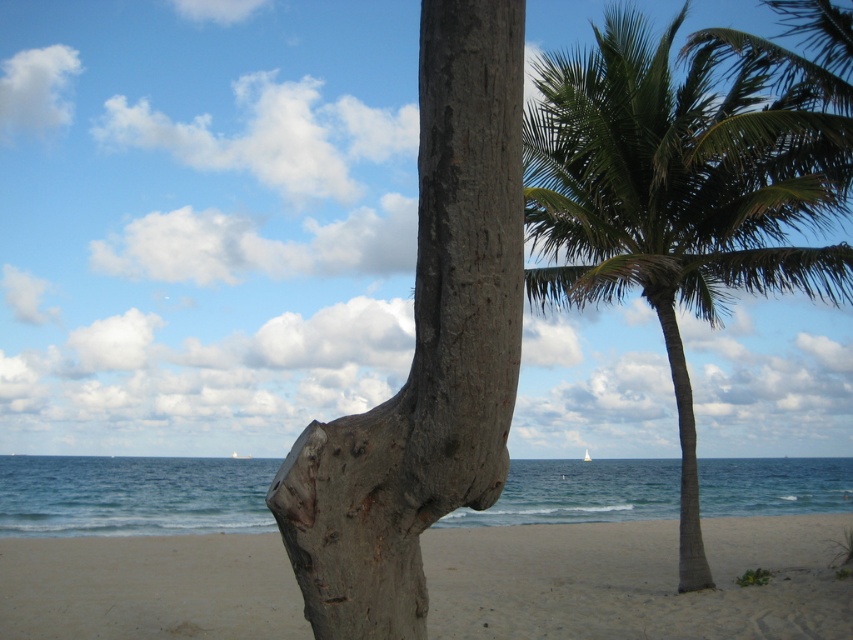
Which is above, green leafy coconut tree at right or gray rough bark tree trunk at center?

Positioned higher is green leafy coconut tree at right.

Is green leafy coconut tree at right to the left of gray rough bark tree trunk at center from the viewer's perspective?

Incorrect, green leafy coconut tree at right is not on the left side of gray rough bark tree trunk at center.

What do you see at coordinates (679, 195) in the screenshot? I see `green leafy coconut tree at right` at bounding box center [679, 195].

Locate an element on the screen. This screenshot has height=640, width=853. green leafy coconut tree at right is located at coordinates (679, 195).

Does gray rough bark tree trunk at center have a lesser height compared to sandy beige at lower center?

Yes.

Which is behind, point (433, 346) or point (149, 584)?

The point (149, 584) is more distant.

The image size is (853, 640). In order to click on gray rough bark tree trunk at center in this screenshot , I will do `click(426, 349)`.

Locate an element on the screen. The width and height of the screenshot is (853, 640). green leafy coconut tree at right is located at coordinates (679, 195).

In the scene shown: Between green leafy coconut tree at right and sandy beige at lower center, which one appears on the right side from the viewer's perspective?

From the viewer's perspective, green leafy coconut tree at right appears more on the right side.

Who is more distant from viewer, (776,84) or (821,525)?

Point (821,525)

You are a GUI agent. You are given a task and a screenshot of the screen. Output one action in this format:
    pyautogui.click(x=<x>, y=<y>)
    Task: Click on the green leafy coconut tree at right
    Image resolution: width=853 pixels, height=640 pixels.
    Given the screenshot: What is the action you would take?
    pyautogui.click(x=679, y=195)